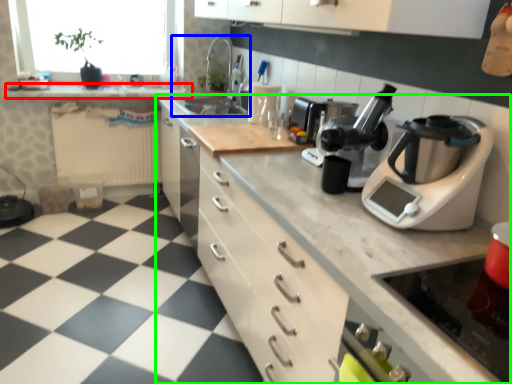
Question: Considering the real-world distances, which object is closest to counter top (highlighted by a red box)? sink (highlighted by a blue box) or countertop (highlighted by a green box).

Choices:
 (A) sink
 (B) countertop

Answer: (A)